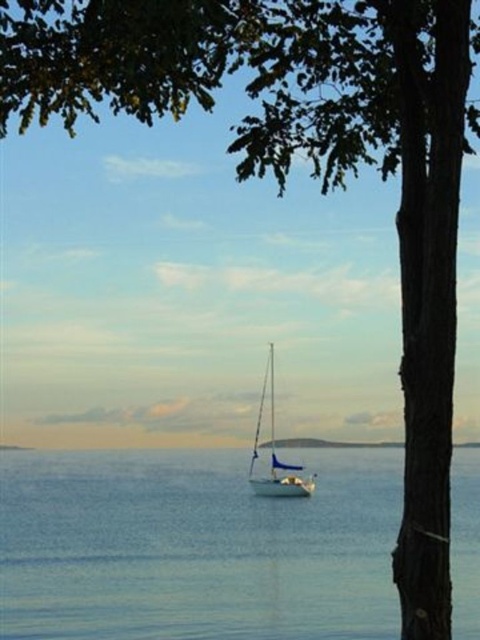
You are standing at the point with coordinates point (194, 547). What is the nearest object to you?

The nearest object to you is the blue water at center because the point (194, 547) is on blue water at center.

You are standing on the shore and want to throw a pebble to hit the white glossy sailboat at center. The blue water at center is between you and the sailboat. If the pebble travels in a straight line, will it hit the sailboat?

The blue water at center is 4.94 meters from the white glossy sailboat at center. Since the water is between you and the sailboat, the pebble would have to travel through the water to reach the sailboat. However, water is a liquid and cannot block the path, so the pebble will hit the sailboat.

You are a photographer standing on the coast and see the blue water at center and the white glossy sailboat at center. Which object is positioned to the right side of the other?

The blue water at center is positioned to the right of the white glossy sailboat at center.